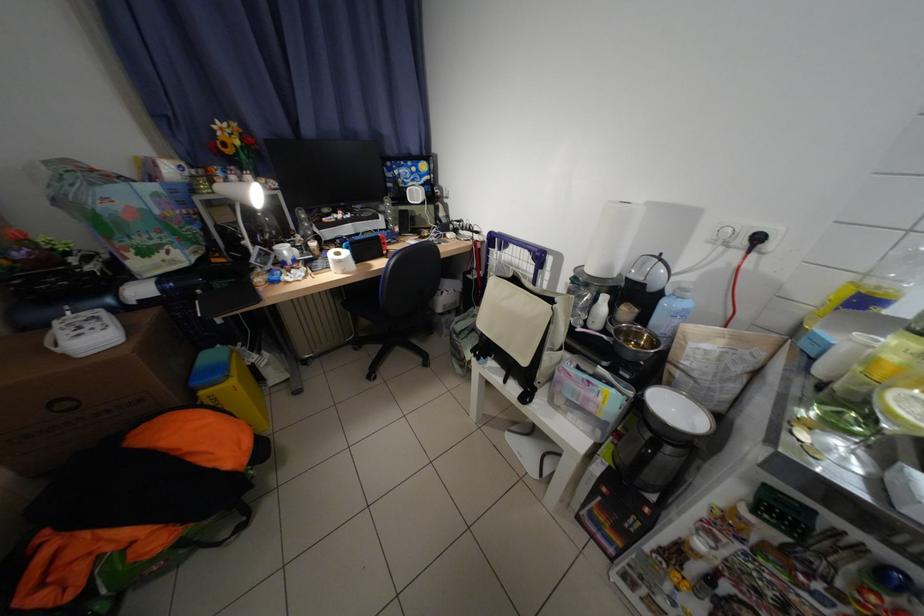
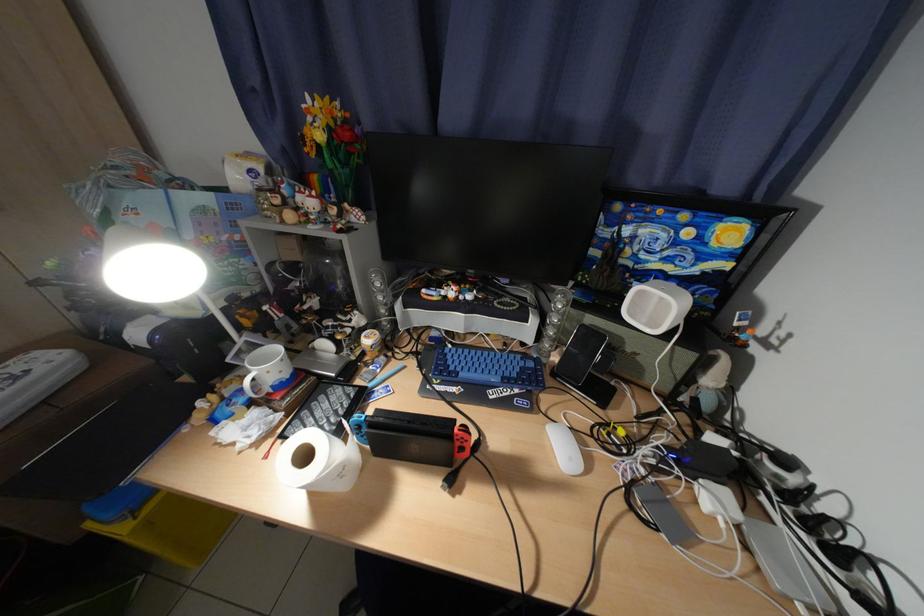
Locate, in the second image, the point that corresponds to (324,246) in the first image.

(381, 341)